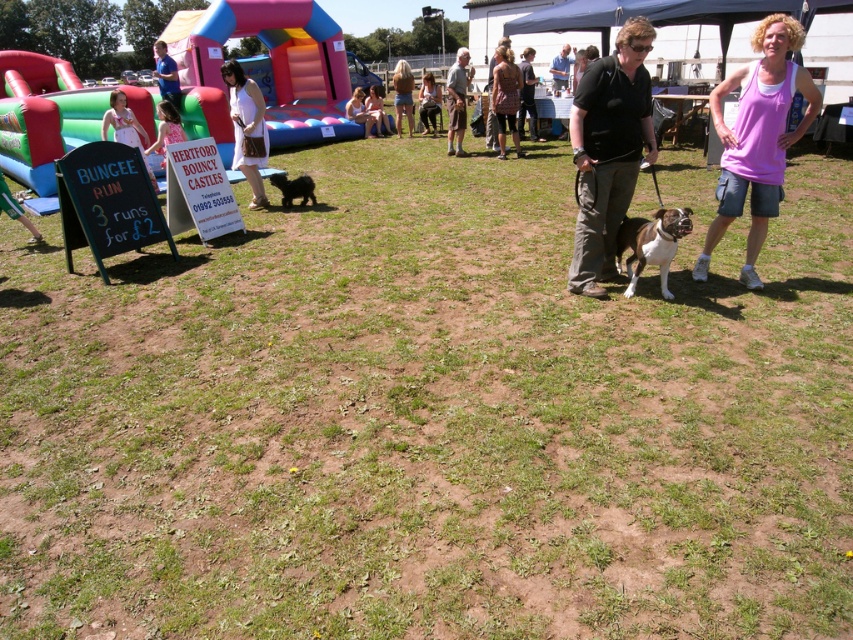
Is white dress at left wider than dark brown leather jacket at center?

Yes, white dress at left is wider than dark brown leather jacket at center.

Is white dress at left thinner than dark brown leather jacket at center?

Incorrect, white dress at left's width is not less than dark brown leather jacket at center's.

At what (x,y) coordinates should I click in order to perform the action: click on white dress at left. Please return your answer as a coordinate pair (x, y). The height and width of the screenshot is (640, 853). Looking at the image, I should click on (125, 128).

Does black fabric shirt at center appear under blonde hair at center?

Correct, black fabric shirt at center is located below blonde hair at center.

Is black fabric shirt at center above blonde hair at center?

No.

Is point (606, 170) farther from camera compared to point (410, 72)?

No, (606, 170) is in front of (410, 72).

What are the coordinates of `black fabric shirt at center` in the screenshot? It's located at (608, 150).

Does point (622, 150) come farther from viewer compared to point (515, 84)?

No, (622, 150) is closer to viewer.

This screenshot has height=640, width=853. Find the location of `black fabric shirt at center`. black fabric shirt at center is located at coordinates (608, 150).